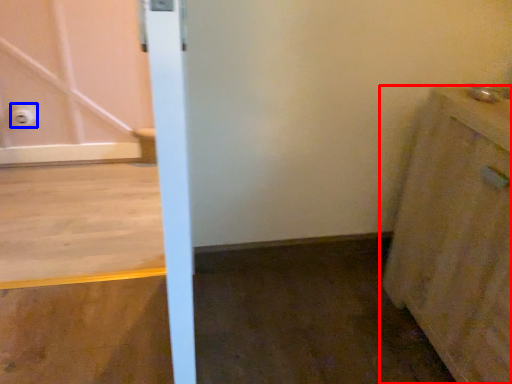
Question: Which of the following is the closest to the observer, cabinetry (highlighted by a red box) or electric outlet (highlighted by a blue box)?

Choices:
 (A) cabinetry
 (B) electric outlet

Answer: (A)